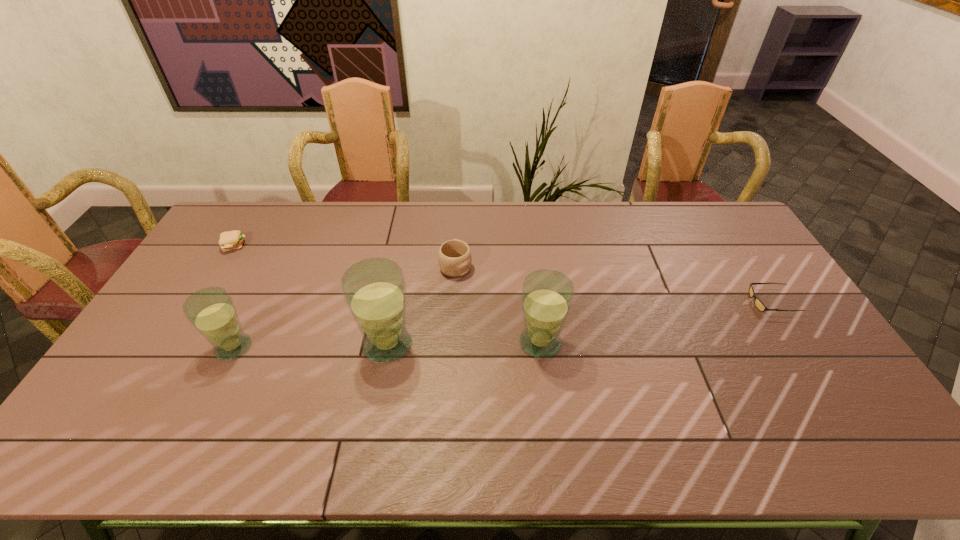
Where is `vacant place for an extra glass on the right`? Image resolution: width=960 pixels, height=540 pixels. vacant place for an extra glass on the right is located at coordinates (691, 341).